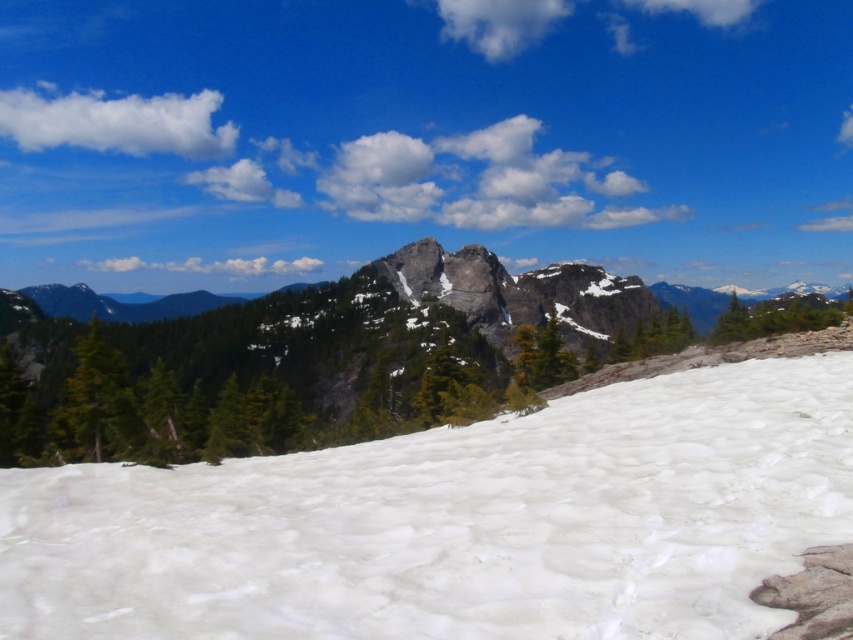
Between white snow at center and rocky mountain at center, which one appears on the right side from the viewer's perspective?

white snow at center is more to the right.

Between white snow at center and rocky mountain at center, which one appears on the left side from the viewer's perspective?

rocky mountain at center is more to the left.

I want to click on white snow at center, so click(x=457, y=522).